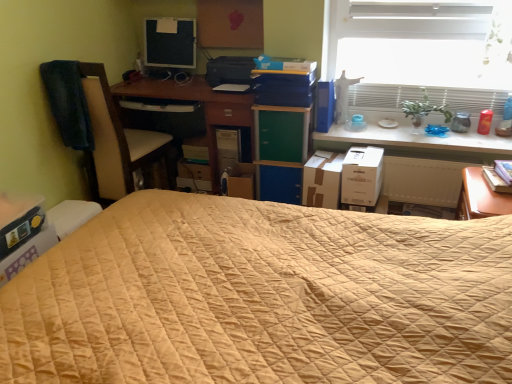
Question: Does green matte/blackboard at center, the second paperback book when ordered from left to right, have a lesser height compared to white cardboard box at right, which ranks as the first cardboard box in right-to-left order?

Choices:
 (A) no
 (B) yes

Answer: (B)

Question: Could you tell me if green matte/blackboard at center, the second paperback book when ordered from left to right, is turned towards white cardboard box at right, which ranks as the first cardboard box in right-to-left order?

Choices:
 (A) yes
 (B) no

Answer: (B)

Question: Is white cardboard box at right, which ranks as the first cardboard box in right-to-left order, at the back of green matte/blackboard at center, the second paperback book when ordered from left to right?

Choices:
 (A) yes
 (B) no

Answer: (B)

Question: Is green matte/blackboard at center, placed as the 3th paperback book when sorted from right to left, in contact with white cardboard box at right, the 3th cardboard box when ordered from left to right?

Choices:
 (A) yes
 (B) no

Answer: (B)

Question: From the image's perspective, is green matte/blackboard at center, placed as the 3th paperback book when sorted from right to left, beneath white cardboard box at right, the 3th cardboard box when ordered from left to right?

Choices:
 (A) no
 (B) yes

Answer: (A)

Question: From the image's perspective, is matte black computer tower at center located above or below cardboard box at lower left, marked as the third cardboard box in a right-to-left arrangement?

Choices:
 (A) below
 (B) above

Answer: (B)

Question: From their relative heights in the image, would you say matte black computer tower at center is taller or shorter than cardboard box at lower left, placed as the 1th cardboard box when sorted from left to right?

Choices:
 (A) tall
 (B) short

Answer: (A)

Question: Is matte black computer tower at center in front of or behind cardboard box at lower left, placed as the 1th cardboard box when sorted from left to right, in the image?

Choices:
 (A) front
 (B) behind

Answer: (B)

Question: From a real-world perspective, is matte black computer tower at center physically located above or below cardboard box at lower left, marked as the third cardboard box in a right-to-left arrangement?

Choices:
 (A) below
 (B) above

Answer: (A)

Question: Is brown leather swivel chair at left in front of or behind matte black computer tower at center in the image?

Choices:
 (A) front
 (B) behind

Answer: (A)

Question: Is brown leather swivel chair at left situated inside matte black computer tower at center or outside?

Choices:
 (A) outside
 (B) inside

Answer: (A)

Question: Visually, is brown leather swivel chair at left positioned to the left or to the right of matte black computer tower at center?

Choices:
 (A) right
 (B) left

Answer: (B)

Question: From the image's perspective, is brown leather swivel chair at left located above or below matte black computer tower at center?

Choices:
 (A) above
 (B) below

Answer: (A)

Question: From the image's perspective, is brown leather swivel chair at left above or below white glossy table at upper right?

Choices:
 (A) below
 (B) above

Answer: (B)

Question: Considering the relative positions of brown leather swivel chair at left and white glossy table at upper right in the image provided, is brown leather swivel chair at left to the left or to the right of white glossy table at upper right?

Choices:
 (A) right
 (B) left

Answer: (B)